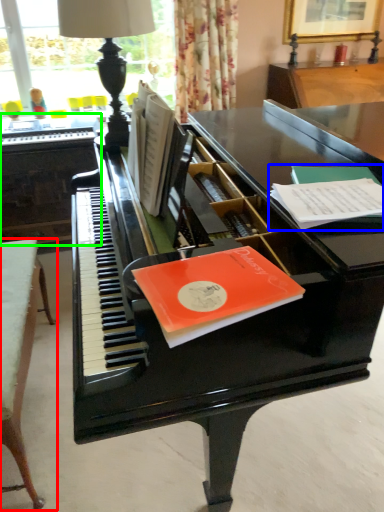
Question: Considering the real-world distances, which object is farthest from table (highlighted by a red box)? paperback book (highlighted by a blue box) or table (highlighted by a green box)?

Choices:
 (A) paperback book
 (B) table

Answer: (A)